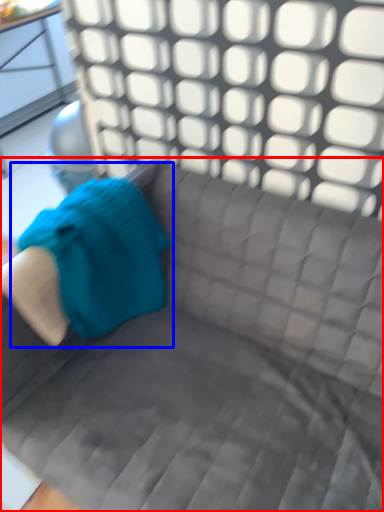
Question: Which object appears farthest to the camera in this image, studio couch (highlighted by a red box) or bean bag chair (highlighted by a blue box)?

Choices:
 (A) studio couch
 (B) bean bag chair

Answer: (B)